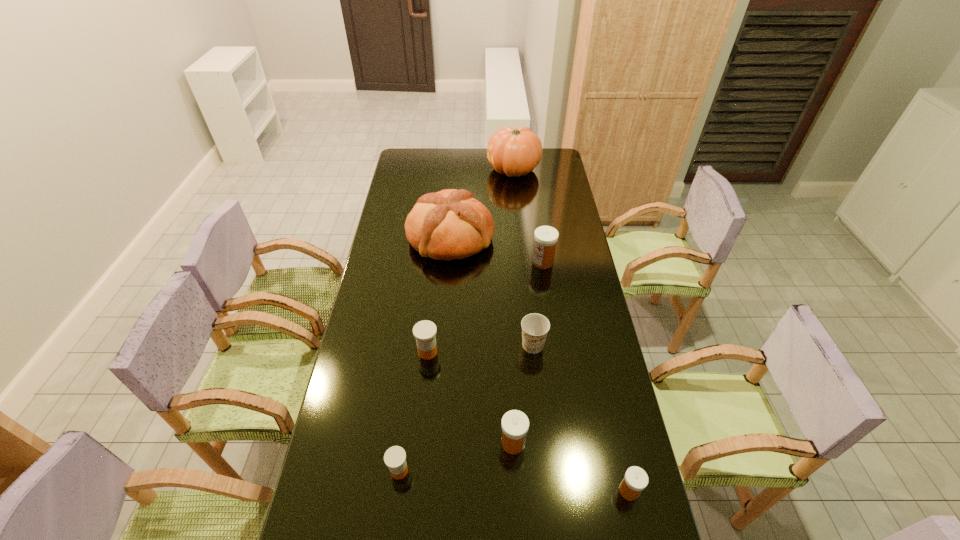
Locate an element on the screen. The width and height of the screenshot is (960, 540). free space located 0.050m on the label of the nearer orange medicine is located at coordinates (428, 471).

Where is `vacant area situated on the left of the rightmost object`? This screenshot has height=540, width=960. vacant area situated on the left of the rightmost object is located at coordinates (573, 491).

Find the location of `object that is positioned at the far edge`. object that is positioned at the far edge is located at coordinates (515, 152).

Find the location of a particular element. object present at the left edge is located at coordinates (450, 224).

Locate an element on the screen. pumpkin at the right edge is located at coordinates (515, 152).

I want to click on object located in the far right corner section of the desktop, so click(515, 152).

The image size is (960, 540). I want to click on vacant space at the far edge of the desktop, so click(468, 172).

The image size is (960, 540). I want to click on vacant region at the left edge of the desktop, so click(x=401, y=282).

In the image, there is a desktop. Where is `free space at the right edge`? free space at the right edge is located at coordinates (559, 175).

Where is `free space at the far left corner of the desktop`? free space at the far left corner of the desktop is located at coordinates (424, 155).